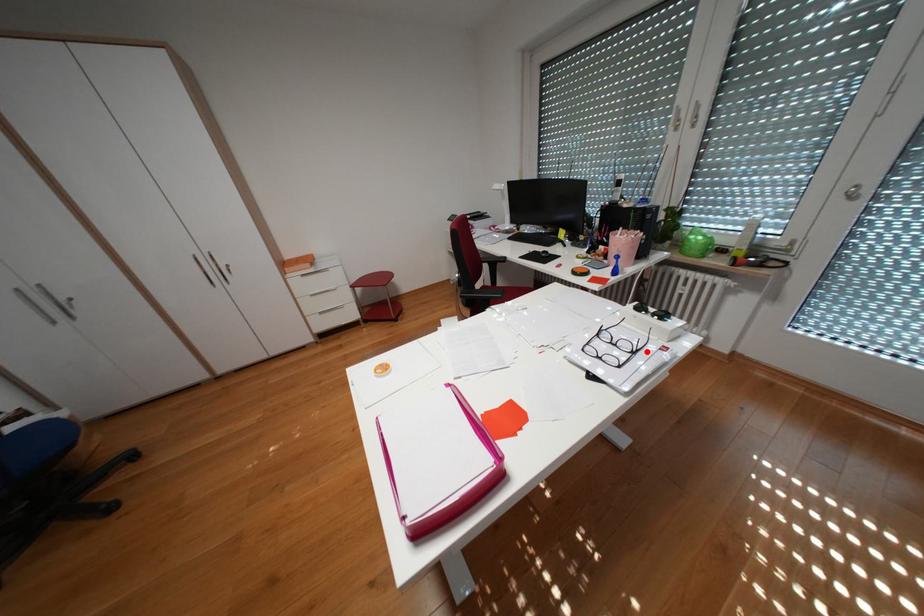
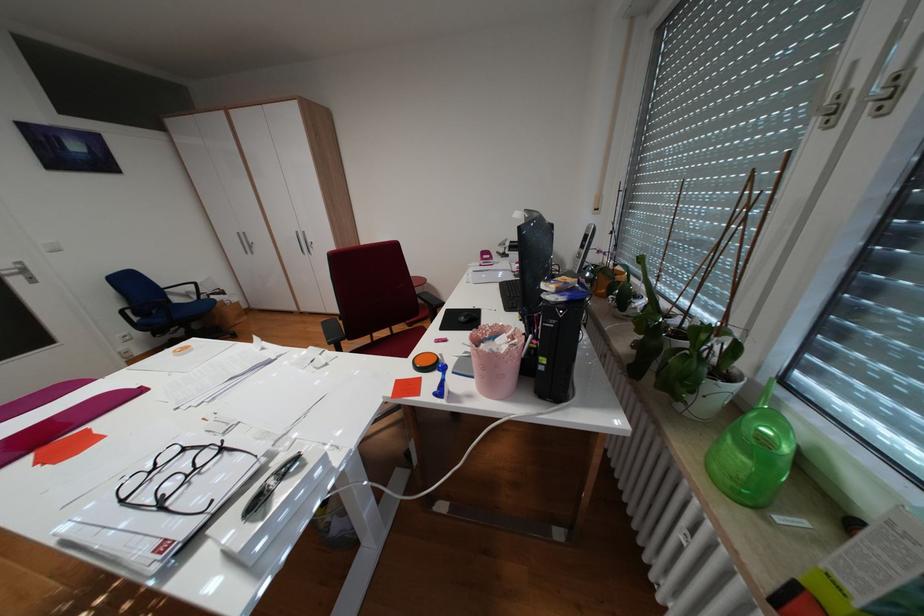
Where in the second image is the point corresponding to the highlighted location from the first image?

(173, 505)